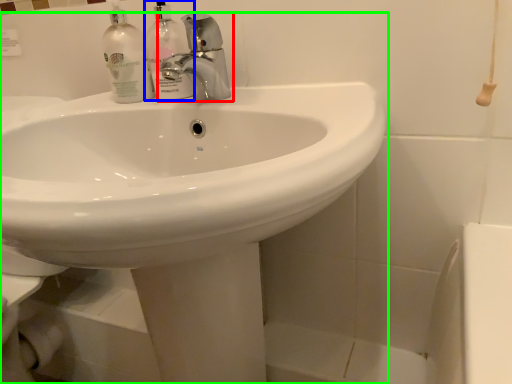
Question: Estimate the real-world distances between objects in this image. Which object is closer to tap (highlighted by a red box), cleaning product (highlighted by a blue box) or sink (highlighted by a green box)?

Choices:
 (A) cleaning product
 (B) sink

Answer: (A)